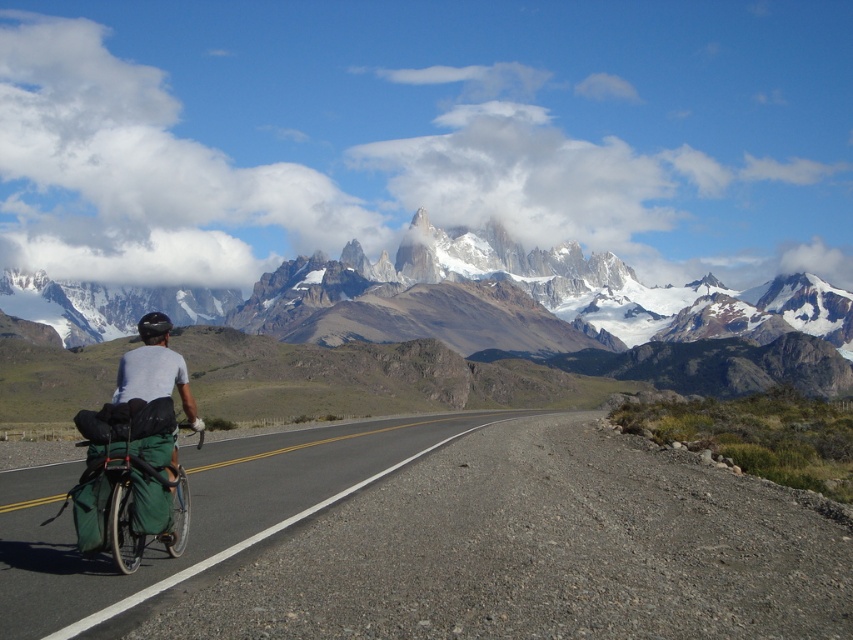
You are a cyclist planning to ride along the road in the image. You notice two points marked on the road ahead of you. The first point is at coordinates point (161, 572) and the second point is at point (189, 385). Which point is closer to your current position?

Point (161, 572) is closer to the camera than point (189, 385), so the first point is closer to your current position.

You are a photographer positioned at the camera location. You want to place a marker exactly where the cyclist is currently located, which is at point (96, 602). If you walk 49.06 meters directly towards the cyclist, will you reach the marker?

Yes, because the distance between the camera and the point is exactly 49.06 meters, so walking that distance directly towards it would reach the marker.